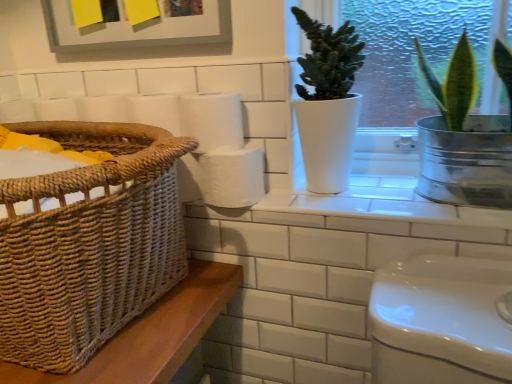
Locate an element on the screen. free space to the left of metallic silver pot at upper right, which is counted as the second houseplant, starting from the left is located at coordinates [x=383, y=201].